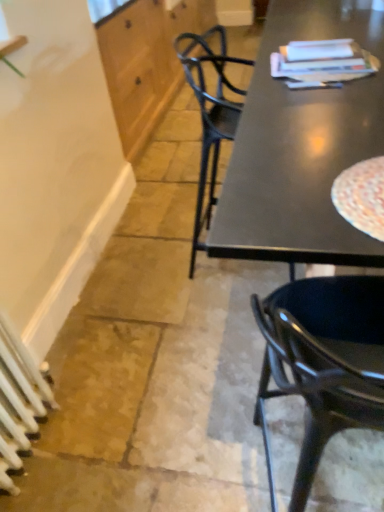
Locate an element on the screen. vacant area that lies between white metallic radiator at lower left and glossy black chair at right is located at coordinates (132, 455).